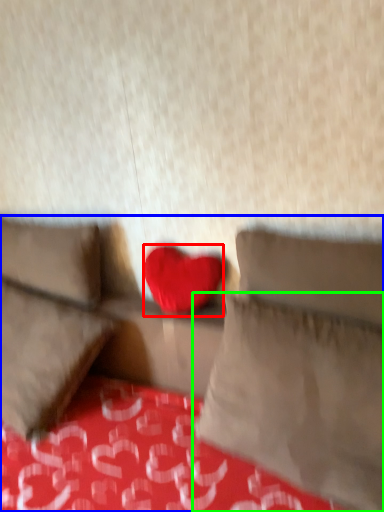
Question: Which object is the closest to the heart (highlighted by a red box)? Choose among these: studio couch (highlighted by a blue box) or pillow (highlighted by a green box).

Choices:
 (A) studio couch
 (B) pillow

Answer: (A)